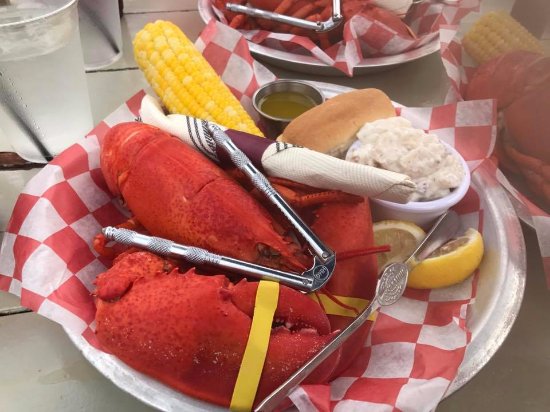
What are the coordinates of `glass` in the screenshot? It's located at (57, 103).